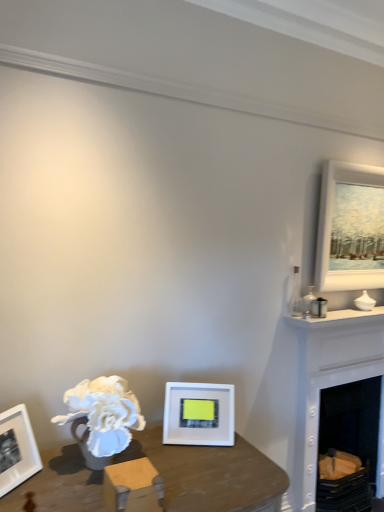
Question: From a real-world perspective, does white matte picture frame at lower center, placed as the 1th picture frame when sorted from left to right, sit lower than white matte picture frame at upper right, which is the second picture frame from left to right?

Choices:
 (A) yes
 (B) no

Answer: (A)

Question: From the image's perspective, is white matte picture frame at lower center, placed as the first picture frame when sorted from front to back, located beneath white matte picture frame at upper right, the second picture frame from the front?

Choices:
 (A) no
 (B) yes

Answer: (B)

Question: Can we say white matte picture frame at lower center, placed as the first picture frame when sorted from front to back, lies outside white matte picture frame at upper right, acting as the first picture frame starting from the back?

Choices:
 (A) yes
 (B) no

Answer: (A)

Question: Does white matte picture frame at lower center, the 2th picture frame in the right-to-left sequence, have a greater width compared to white matte picture frame at upper right, the second picture frame from the front?

Choices:
 (A) no
 (B) yes

Answer: (B)

Question: Is white matte picture frame at lower center, the 2th picture frame in the right-to-left sequence, aimed at white matte picture frame at upper right, the second picture frame from the front?

Choices:
 (A) no
 (B) yes

Answer: (A)

Question: From a real-world perspective, relative to white painted wood fireplace at right, is white matte picture frame at lower center, the 2th picture frame in the right-to-left sequence, vertically above or below?

Choices:
 (A) below
 (B) above

Answer: (B)

Question: Is white matte picture frame at lower center, marked as the second picture frame in a top-to-bottom arrangement, wider or thinner than white painted wood fireplace at right?

Choices:
 (A) wide
 (B) thin

Answer: (B)

Question: From the image's perspective, is white matte picture frame at lower center, the 2th picture frame viewed from the back, above or below white painted wood fireplace at right?

Choices:
 (A) above
 (B) below

Answer: (A)

Question: Considering the positions of white matte picture frame at lower center, the 2th picture frame viewed from the back, and white painted wood fireplace at right in the image, is white matte picture frame at lower center, the 2th picture frame viewed from the back, bigger or smaller than white painted wood fireplace at right?

Choices:
 (A) big
 (B) small

Answer: (B)

Question: From the image's perspective, is white matte picture frame at lower center, the 2th picture frame viewed from the back, positioned above or below white matte picture frame at upper right, which is the second picture frame from left to right?

Choices:
 (A) above
 (B) below

Answer: (B)

Question: In terms of width, does white matte picture frame at lower center, placed as the first picture frame when sorted from front to back, look wider or thinner when compared to white matte picture frame at upper right, the 2th picture frame when ordered from bottom to top?

Choices:
 (A) thin
 (B) wide

Answer: (B)

Question: Does point (178, 434) appear closer or farther from the camera than point (354, 243)?

Choices:
 (A) farther
 (B) closer

Answer: (B)

Question: From a real-world perspective, relative to white matte picture frame at upper right, the second picture frame from the front, is white matte picture frame at lower center, placed as the first picture frame when sorted from front to back, vertically above or below?

Choices:
 (A) above
 (B) below

Answer: (B)

Question: Is white painted wood fireplace at right to the left or to the right of white matte picture frame at lower center, placed as the 1th picture frame when sorted from left to right, in the image?

Choices:
 (A) right
 (B) left

Answer: (A)

Question: In terms of size, does white painted wood fireplace at right appear bigger or smaller than white matte picture frame at lower center, the 2th picture frame viewed from the back?

Choices:
 (A) small
 (B) big

Answer: (B)